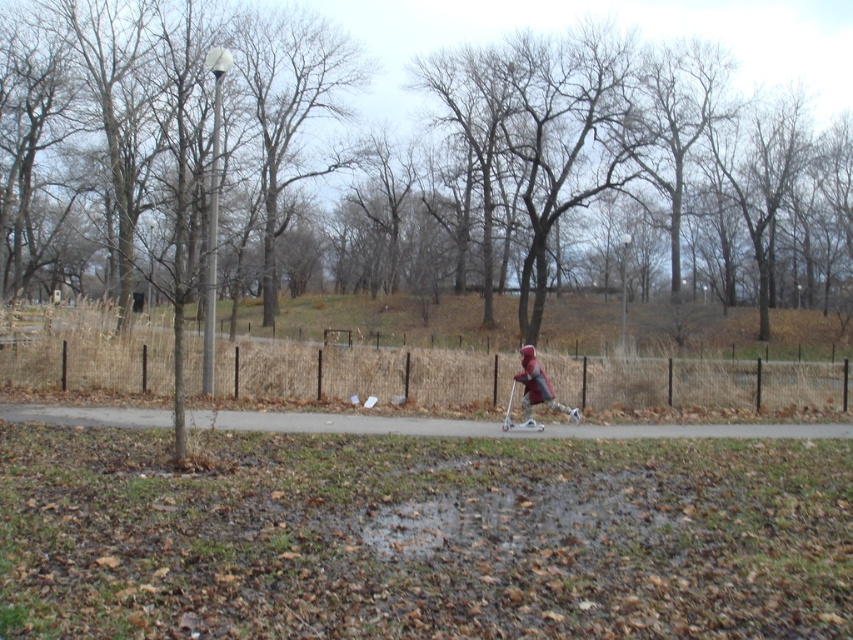
Question: Which object is the farthest from the smooth asphalt path at center?

Choices:
 (A) matte red jacket at center
 (B) matte red scooter at center

Answer: (A)

Question: Does smooth asphalt path at center have a smaller size compared to matte red jacket at center?

Choices:
 (A) no
 (B) yes

Answer: (A)

Question: Does smooth asphalt path at center lie in front of matte red jacket at center?

Choices:
 (A) yes
 (B) no

Answer: (A)

Question: Which object is closer to the camera taking this photo?

Choices:
 (A) smooth asphalt path at center
 (B) matte red jacket at center
 (C) matte red scooter at center

Answer: (C)

Question: Which of the following is the closest to the observer?

Choices:
 (A) (561, 408)
 (B) (572, 572)

Answer: (B)

Question: Can you confirm if smooth asphalt path at center is bigger than matte red jacket at center?

Choices:
 (A) yes
 (B) no

Answer: (A)